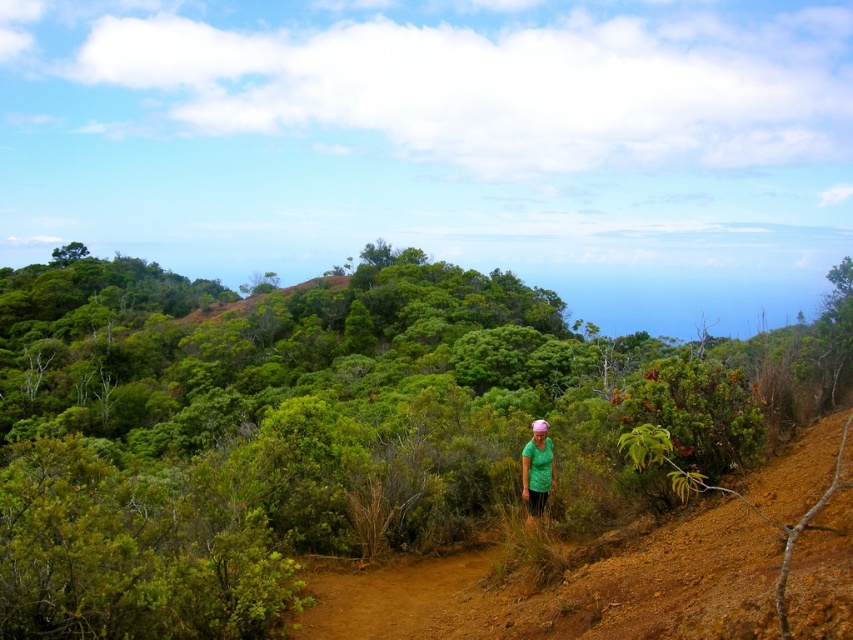
Can you confirm if green leafy shrubs at center is positioned to the right of green matte shirt at center?

No, green leafy shrubs at center is not to the right of green matte shirt at center.

Between point (392, 470) and point (526, 472), which one is positioned behind?

The point (392, 470) is behind.

Where is `green leafy shrubs at center`? green leafy shrubs at center is located at coordinates (305, 432).